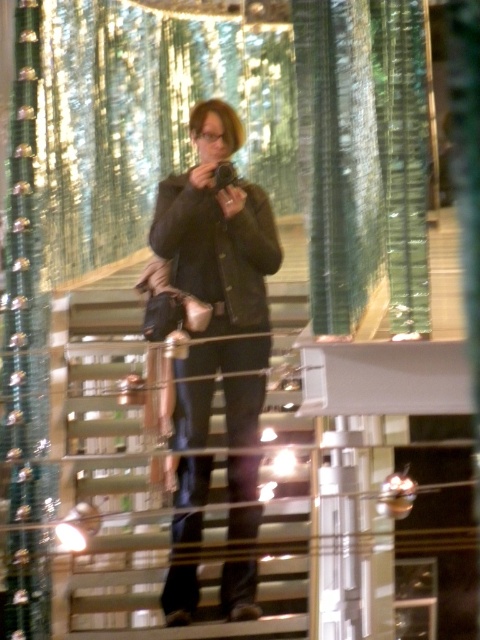
Question: Is metallic silver stairwell at center further to the viewer compared to matte black jacket at center?

Choices:
 (A) no
 (B) yes

Answer: (B)

Question: Is metallic silver stairwell at center positioned at the back of matte black jacket at center?

Choices:
 (A) no
 (B) yes

Answer: (B)

Question: Which point appears closest to the camera in this image?

Choices:
 (A) (196, 173)
 (B) (144, 532)

Answer: (A)

Question: Can you confirm if metallic silver stairwell at center is positioned to the left of matte black jacket at center?

Choices:
 (A) no
 (B) yes

Answer: (A)